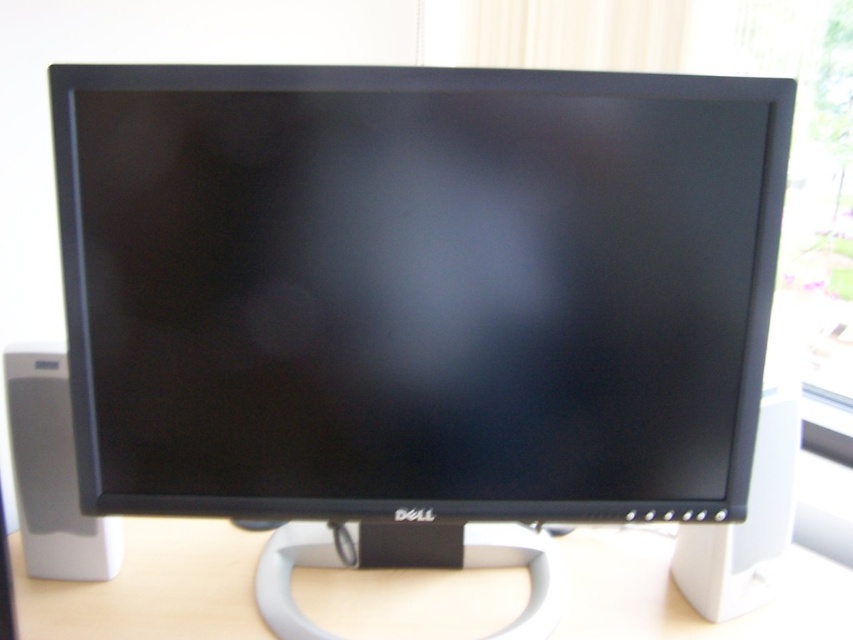
Question: Which point is closer to the camera taking this photo?

Choices:
 (A) (107, 564)
 (B) (701, 592)

Answer: (B)

Question: Does white plastic speaker at left have a greater width compared to white plastic speaker at right?

Choices:
 (A) yes
 (B) no

Answer: (A)

Question: Among these objects, which one is nearest to the camera?

Choices:
 (A) light wood computer desk at center
 (B) white plastic speaker at left

Answer: (A)

Question: Does white plastic speaker at left have a lesser width compared to white plastic speaker at right?

Choices:
 (A) no
 (B) yes

Answer: (A)

Question: Is the position of light wood computer desk at center less distant than that of white plastic speaker at left?

Choices:
 (A) yes
 (B) no

Answer: (A)

Question: Which point is farther from the camera taking this photo?

Choices:
 (A) (7, 385)
 (B) (445, 580)
 (C) (729, 538)

Answer: (B)